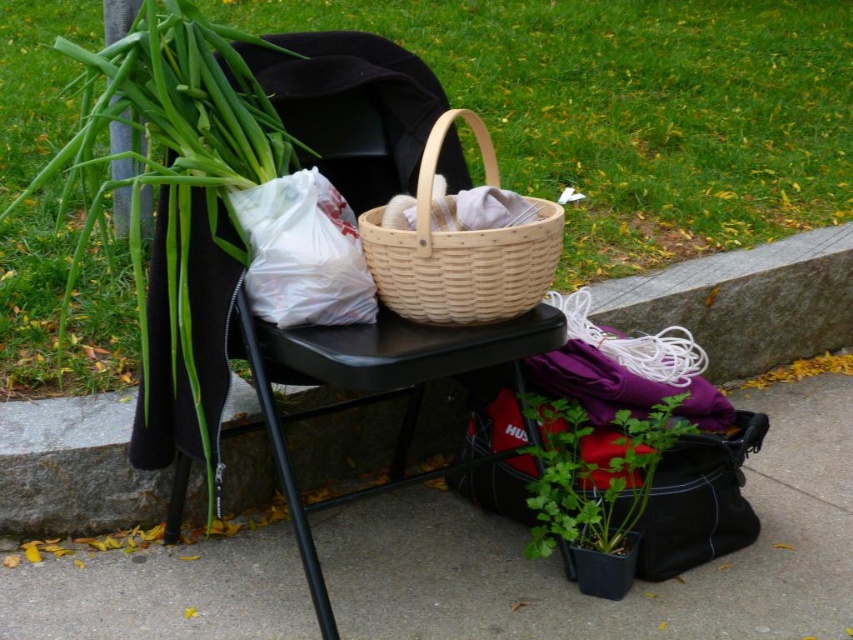
The height and width of the screenshot is (640, 853). What do you see at coordinates (175, 161) in the screenshot?
I see `green matte plant at left` at bounding box center [175, 161].

Who is higher up, green matte plant at left or white plastic bag at upper center?

white plastic bag at upper center is higher up.

Is point (136, 152) behind point (285, 234)?

Yes, it is behind point (285, 234).

Identify the location of green matte plant at left. (175, 161).

Between black plastic tray at lower center and green matte plant at left, which one has more height?

Standing taller between the two is green matte plant at left.

Can you confirm if black plastic tray at lower center is thinner than green matte plant at left?

No.

The width and height of the screenshot is (853, 640). What do you see at coordinates (634, 584) in the screenshot?
I see `black plastic tray at lower center` at bounding box center [634, 584].

Find the location of `black plastic tray at lower center`. black plastic tray at lower center is located at coordinates (634, 584).

Is point (260, 216) farther from camera compared to point (141, 0)?

No.

Does white plastic bag at upper center lie behind green matte pole at upper left?

No.

Which is in front, point (276, 241) or point (115, 205)?

Positioned in front is point (276, 241).

The width and height of the screenshot is (853, 640). In order to click on white plastic bag at upper center in this screenshot , I will do `click(303, 252)`.